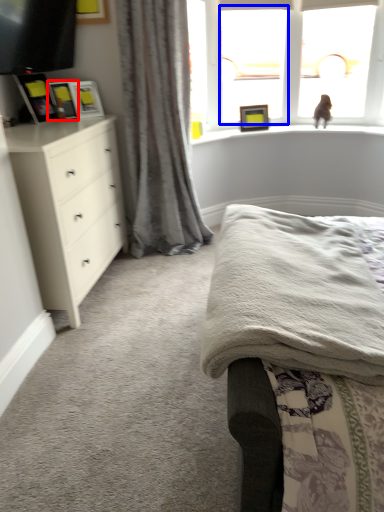
Question: Which object is closer to the camera taking this photo, picture frame (highlighted by a red box) or window screen (highlighted by a blue box)?

Choices:
 (A) picture frame
 (B) window screen

Answer: (A)